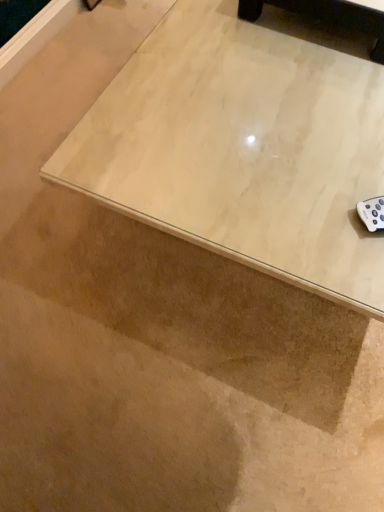
Where is `free spot in front of light wood coffee table at upper center`? The image size is (384, 512). free spot in front of light wood coffee table at upper center is located at coordinates (299, 94).